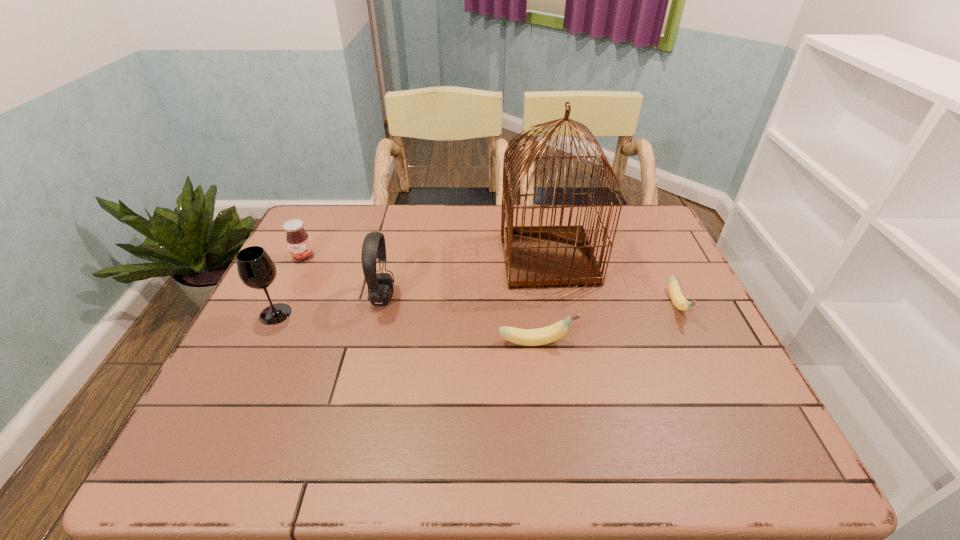
In the image, there is a desktop. What are the coordinates of `vacant area at the left edge` in the screenshot? It's located at (285, 283).

Where is `vacant region at the right edge of the desktop`? This screenshot has height=540, width=960. vacant region at the right edge of the desktop is located at coordinates (628, 272).

You are a GUI agent. You are given a task and a screenshot of the screen. Output one action in this format:
    pyautogui.click(x=<x>, y=<y>)
    Task: Click on the free space at the far left corner
    
    Given the screenshot: What is the action you would take?
    pyautogui.click(x=349, y=210)

The height and width of the screenshot is (540, 960). Find the location of `free space at the far right corner of the desktop`. free space at the far right corner of the desktop is located at coordinates (617, 239).

The image size is (960, 540). Identify the location of vacant area at the near right corner of the desktop. (738, 405).

Image resolution: width=960 pixels, height=540 pixels. Find the location of `free spot between the taller banana and the shortest object`. free spot between the taller banana and the shortest object is located at coordinates (608, 323).

This screenshot has width=960, height=540. I want to click on vacant space in between the right banana and the nearer banana, so click(x=608, y=323).

The height and width of the screenshot is (540, 960). In order to click on empty space between the wineglass and the taller banana in this screenshot , I will do `click(406, 328)`.

Locate an element on the screen. empty space that is in between the headset and the wineglass is located at coordinates (329, 306).

You are a GUI agent. You are given a task and a screenshot of the screen. Output one action in this format:
    pyautogui.click(x=<x>, y=<y>)
    Task: Click on the vacant area that lies between the third shortest object and the nearest object
    The width and height of the screenshot is (960, 540).
    Given the screenshot: What is the action you would take?
    pyautogui.click(x=420, y=299)